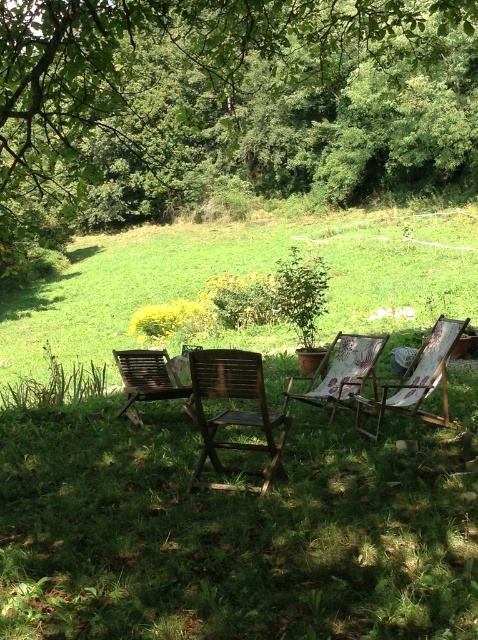
Which of these two, wooden textured chair at center or wooden slatted chair at left, stands taller?

wooden textured chair at center

Does point (330, 392) come farther from viewer compared to point (173, 388)?

No, it is not.

Is point (337, 348) more distant than point (153, 387)?

Yes, point (337, 348) is farther from viewer.

The height and width of the screenshot is (640, 478). I want to click on wooden textured chair at center, so click(x=340, y=372).

Is wooden chair at center thinner than wooden deck chair at right?

Indeed, wooden chair at center has a lesser width compared to wooden deck chair at right.

Is wooden chair at center smaller than wooden deck chair at right?

Correct, wooden chair at center occupies less space than wooden deck chair at right.

Is point (263, 417) closer to camera compared to point (430, 388)?

Yes, it is in front of point (430, 388).

This screenshot has width=478, height=640. Find the location of `wooden chair at center`. wooden chair at center is located at coordinates (234, 408).

Who is more forward, (379, 228) or (445, 394)?

Point (445, 394) is more forward.

Does green grassy at lower center appear on the right side of wooden deck chair at right?

No, green grassy at lower center is not to the right of wooden deck chair at right.

I want to click on green grassy at lower center, so click(240, 275).